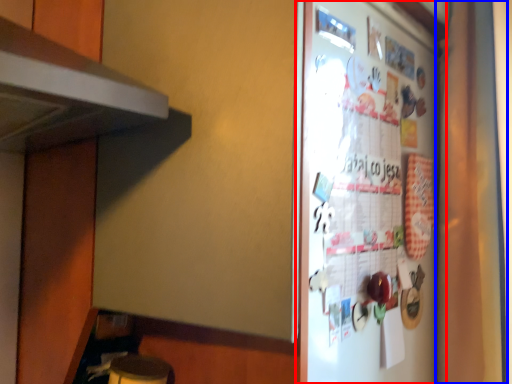
Question: Which point is further to the camera, refrigerator (highlighted by a red box) or curtain (highlighted by a blue box)?

Choices:
 (A) refrigerator
 (B) curtain

Answer: (B)